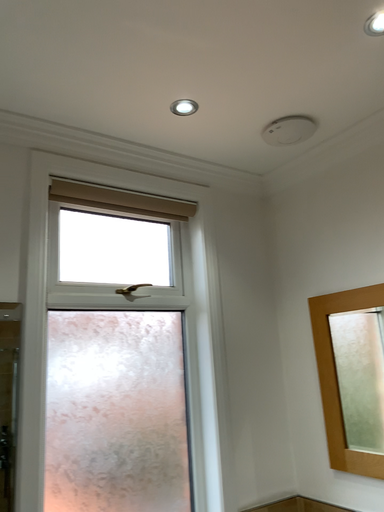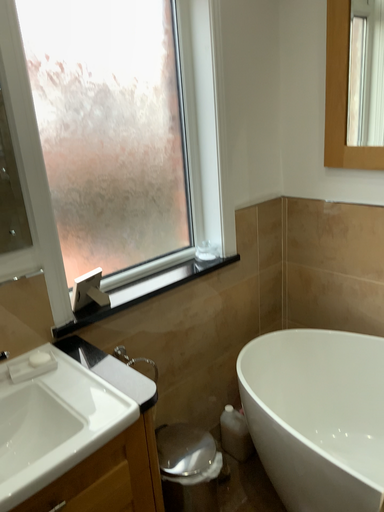
Question: Which way did the camera rotate in the video?

Choices:
 (A) rotated downward
 (B) rotated upward

Answer: (A)